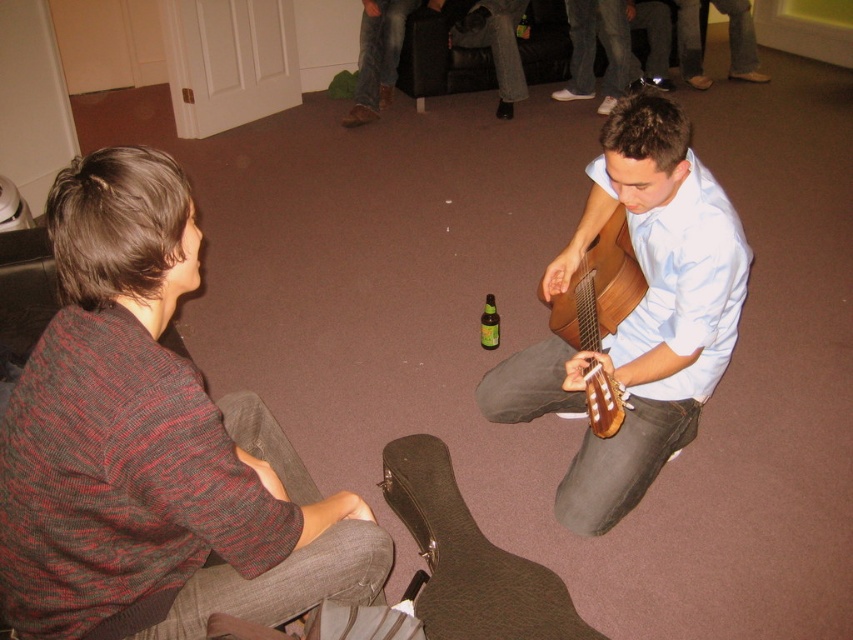
Which of these two, wooden guitar at center or green glass bottle at center, stands shorter?

green glass bottle at center

Consider the image. Is wooden guitar at center further to the viewer compared to green glass bottle at center?

No, wooden guitar at center is in front of green glass bottle at center.

This screenshot has width=853, height=640. Find the location of `wooden guitar at center`. wooden guitar at center is located at coordinates (637, 314).

Is denim jeans at upper right further to camera compared to green glass bottle at center?

Yes.

Who is more distant from viewer, (740, 45) or (486, 294)?

The point (740, 45) is more distant.

Locate an element on the screen. This screenshot has width=853, height=640. denim jeans at upper right is located at coordinates (740, 40).

In the scene shown: Is knit sweater at left further to camera compared to green glass bottle at center?

No, it is in front of green glass bottle at center.

Which is above, knit sweater at left or green glass bottle at center?

Positioned higher is green glass bottle at center.

Where is `knit sweater at left`? The height and width of the screenshot is (640, 853). knit sweater at left is located at coordinates (152, 445).